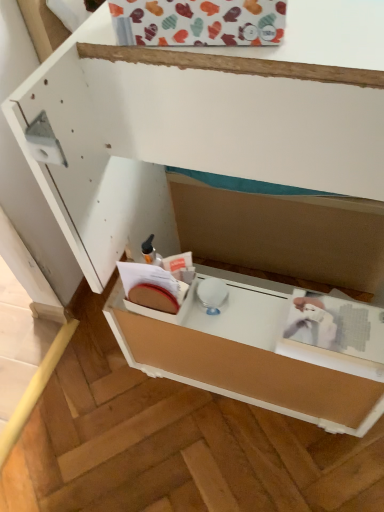
This screenshot has height=512, width=384. Identify the location of free space in front of patterned cardboard box at upper center. (246, 61).